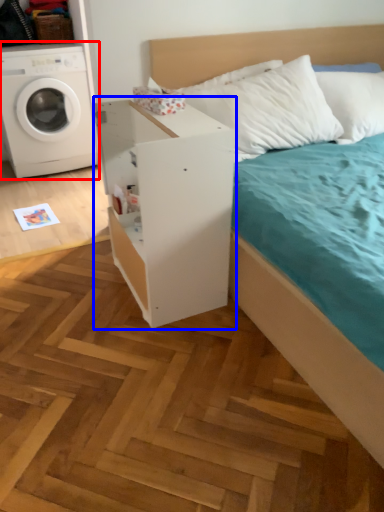
Question: Which point is closer to the camera, washing machine (highlighted by a red box) or dresser (highlighted by a blue box)?

Choices:
 (A) washing machine
 (B) dresser

Answer: (B)